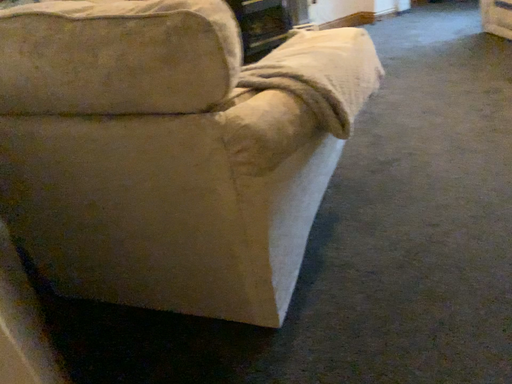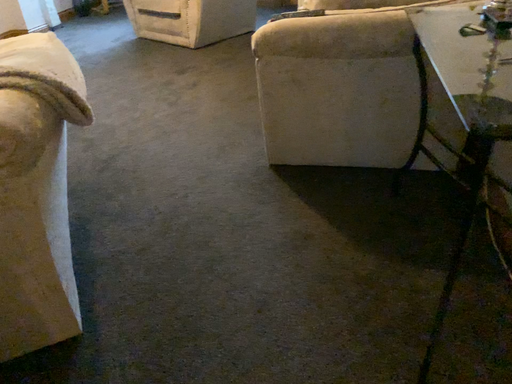
Question: How did the camera likely rotate when shooting the video?

Choices:
 (A) rotated upward
 (B) rotated downward

Answer: (A)